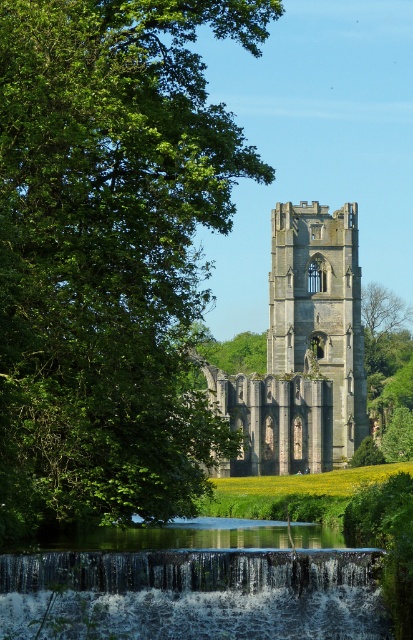
Question: Is green leafy tree at upper left thinner than translucent water cascade at lower center?

Choices:
 (A) no
 (B) yes

Answer: (B)

Question: Is green leafy tree at upper left smaller than stone tower at center?

Choices:
 (A) yes
 (B) no

Answer: (B)

Question: Which point is closer to the camera?

Choices:
 (A) (244, 456)
 (B) (197, 113)

Answer: (B)

Question: Which object is closer to the camera taking this photo?

Choices:
 (A) stone tower at center
 (B) translucent water cascade at lower center
 (C) green leafy tree at upper left

Answer: (B)

Question: Where is green leafy tree at upper left located in relation to stone tower at center in the image?

Choices:
 (A) right
 (B) left

Answer: (B)

Question: Which of these objects is positioned farthest from the stone tower at center?

Choices:
 (A) green leafy tree at upper left
 (B) translucent water cascade at lower center

Answer: (B)